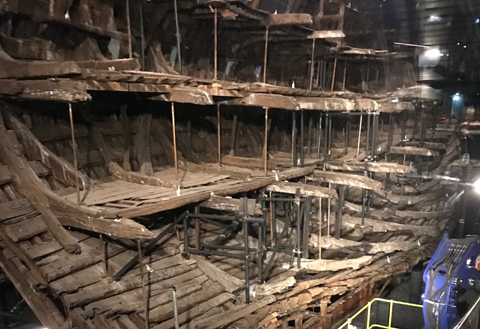
You are a GUI agent. You are given a task and a screenshot of the screen. Output one action in this format:
    pyautogui.click(x=<x>, y=<y>)
    Task: Click on the lights
    Image resolution: width=480 pixels, height=329 pixels.
    Given the screenshot: What is the action you would take?
    pyautogui.click(x=455, y=100), pyautogui.click(x=472, y=186)